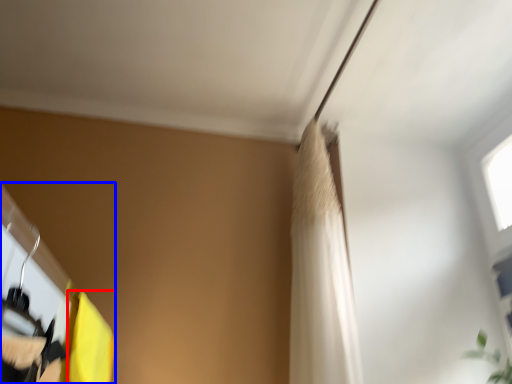
Question: Among these objects, which one is farthest to the camera, curtain (highlighted by a red box) or closet (highlighted by a blue box)?

Choices:
 (A) curtain
 (B) closet

Answer: (A)